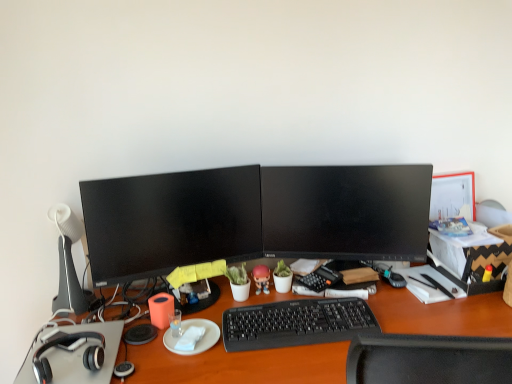
Question: From the image's perspective, is black plastic keyboard at center above matte black monitor at center, acting as the second computer monitor starting from the right?

Choices:
 (A) yes
 (B) no

Answer: (B)

Question: From the image's perspective, is black plastic keyboard at center located beneath matte black monitor at center, which is the first computer monitor in left-to-right order?

Choices:
 (A) no
 (B) yes

Answer: (B)

Question: Considering the relative sizes of black plastic keyboard at center and matte black monitor at center, which is the first computer monitor in left-to-right order, in the image provided, is black plastic keyboard at center bigger than matte black monitor at center, which is the first computer monitor in left-to-right order,?

Choices:
 (A) yes
 (B) no

Answer: (B)

Question: Considering the relative sizes of black plastic keyboard at center and matte black monitor at center, which is the first computer monitor in left-to-right order, in the image provided, is black plastic keyboard at center taller than matte black monitor at center, which is the first computer monitor in left-to-right order,?

Choices:
 (A) yes
 (B) no

Answer: (B)

Question: Is black plastic keyboard at center closer to camera compared to matte black monitor at center, which is the first computer monitor in left-to-right order?

Choices:
 (A) no
 (B) yes

Answer: (B)

Question: Is point (291, 205) positioned closer to the camera than point (130, 183)?

Choices:
 (A) farther
 (B) closer

Answer: (A)

Question: Is black glossy monitor at center, the 2th computer monitor in the left-to-right sequence, wider or thinner than matte black monitor at center, which is the first computer monitor in left-to-right order?

Choices:
 (A) wide
 (B) thin

Answer: (B)

Question: Would you say black glossy monitor at center, the 2th computer monitor in the left-to-right sequence, is to the left or to the right of matte black monitor at center, which is the first computer monitor in left-to-right order, in the picture?

Choices:
 (A) right
 (B) left

Answer: (A)

Question: Considering their positions, is black glossy monitor at center, the 2th computer monitor in the left-to-right sequence, located in front of or behind matte black monitor at center, which is the first computer monitor in left-to-right order?

Choices:
 (A) front
 (B) behind

Answer: (B)

Question: Is matte black monitor at center, which is the first computer monitor in left-to-right order, bigger or smaller than black glossy monitor at center, the 2th computer monitor in the left-to-right sequence?

Choices:
 (A) big
 (B) small

Answer: (A)

Question: Is matte black monitor at center, acting as the second computer monitor starting from the right, spatially inside black glossy monitor at center, the 2th computer monitor in the left-to-right sequence, or outside of it?

Choices:
 (A) outside
 (B) inside

Answer: (A)

Question: Is matte black monitor at center, which is the first computer monitor in left-to-right order, taller or shorter than black glossy monitor at center, arranged as the 1th computer monitor when viewed from the right?

Choices:
 (A) short
 (B) tall

Answer: (B)

Question: In terms of width, does matte black monitor at center, which is the first computer monitor in left-to-right order, look wider or thinner when compared to black glossy monitor at center, the 2th computer monitor in the left-to-right sequence?

Choices:
 (A) wide
 (B) thin

Answer: (A)

Question: From a real-world perspective, is white paper at center physically located above or below black plastic keyboard at center?

Choices:
 (A) above
 (B) below

Answer: (A)

Question: Does point (190, 345) appear closer or farther from the camera than point (318, 342)?

Choices:
 (A) farther
 (B) closer

Answer: (A)